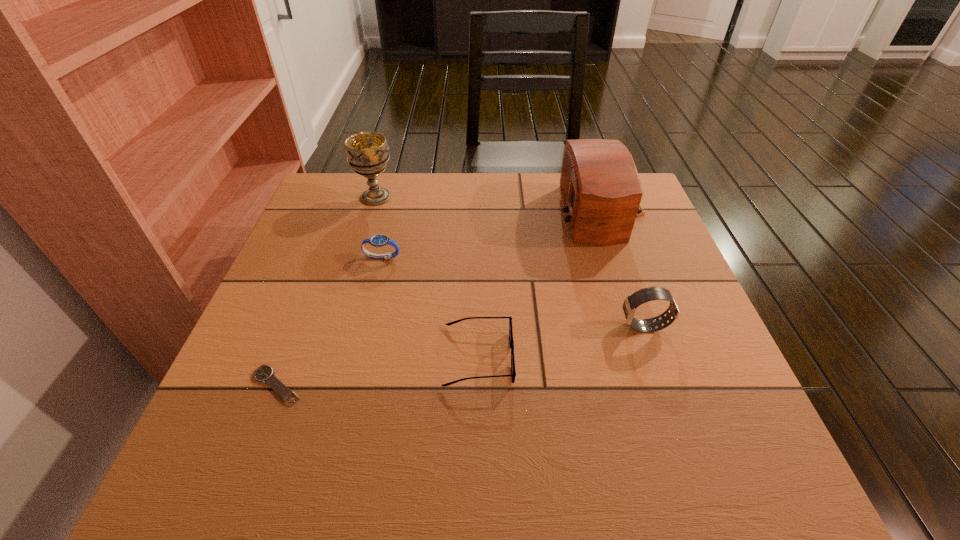
I want to click on blank space located on the front-facing side of the radio receiver, so coord(447,213).

You are a GUI agent. You are given a task and a screenshot of the screen. Output one action in this format:
    pyautogui.click(x=<x>, y=<y>)
    Task: Click on the vacant space positioned 0.140m on the front-facing side of the radio receiver
    
    Given the screenshot: What is the action you would take?
    pyautogui.click(x=507, y=213)

Locate an element on the screen. blank space located 0.240m on the front-facing side of the radio receiver is located at coordinates (469, 213).

Identify the location of free space located on the left of the chalice. [x=327, y=197].

You are a GUI agent. You are given a task and a screenshot of the screen. Output one action in this format:
    pyautogui.click(x=<x>, y=<y>)
    Task: Click on the free space located 0.400m on the face of the second nearest watch
    This screenshot has width=960, height=540.
    Given the screenshot: What is the action you would take?
    pyautogui.click(x=425, y=327)

I want to click on blank area located 0.170m on the face of the second nearest watch, so click(x=538, y=327).

In order to click on vacant space located on the face of the second nearest watch in this screenshot , I will do click(x=503, y=327).

This screenshot has height=540, width=960. What are the coordinates of `vacant space located on the back of the second watch from right to left` in the screenshot? It's located at (396, 200).

Image resolution: width=960 pixels, height=540 pixels. Identify the location of free spot located on the front-facing side of the fifth tallest object. (586, 356).

Where is `vacant space positioned on the back of the shortest object`? The height and width of the screenshot is (540, 960). vacant space positioned on the back of the shortest object is located at coordinates (318, 278).